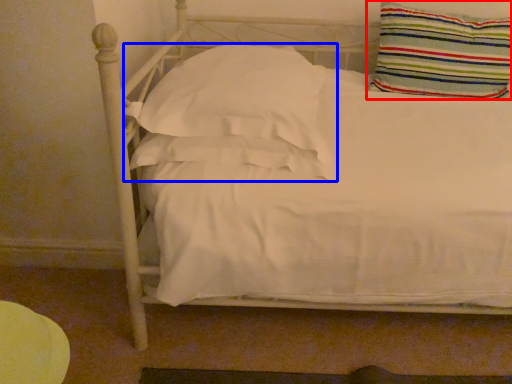
Question: Among these objects, which one is farthest to the camera, pillow (highlighted by a red box) or pillow (highlighted by a blue box)?

Choices:
 (A) pillow
 (B) pillow

Answer: (A)